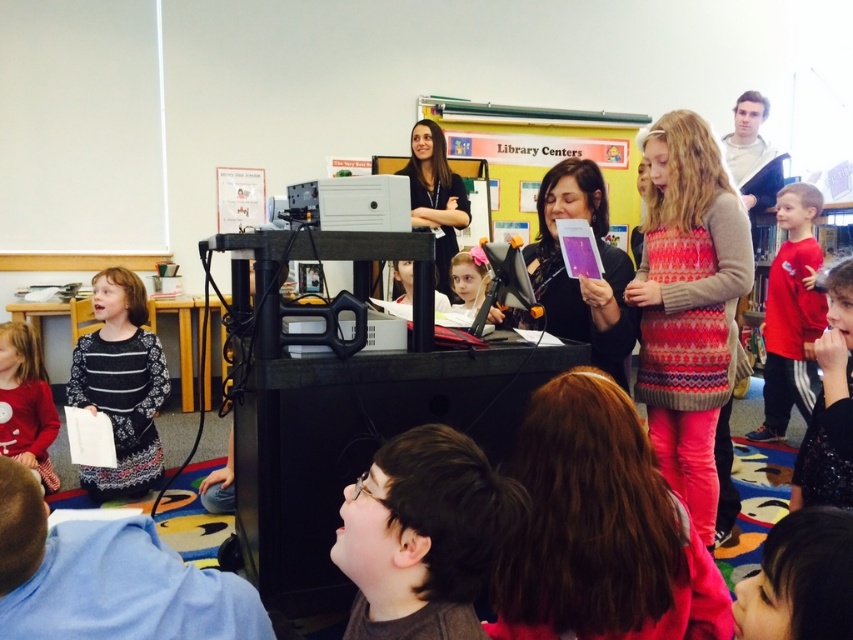
In the classroom scene, you notice two items of interest. One is the dark brown hair at lower center and the other is the red cotton shirt at right. Which of these two items is smaller in size?

The dark brown hair at lower center is smaller than the red cotton shirt at right.

Consider the image. You are a photographer trying to capture both the striped fabric dress at lower left and the red cotton dress at lower left in a single frame. Which dress should you focus on first if you want to ensure both are in the shot?

The striped fabric dress at lower left is bigger than the red cotton dress at lower left, so focusing on the striped fabric dress at lower left first will help ensure both are in the shot since it takes up more space.

You are standing at the camera position in the classroom. There is a point at coordinates point (383,600). Can you reach that point by taking 2 steps forward?

The point at coordinates point (383,600) is 3.44 feet away from the camera. Assuming an average step length of about 2.5 feet, taking 2 steps forward would cover approximately 5 feet, which exceeds the distance to the point. Therefore, you would pass the point and go beyond it after 2 steps.